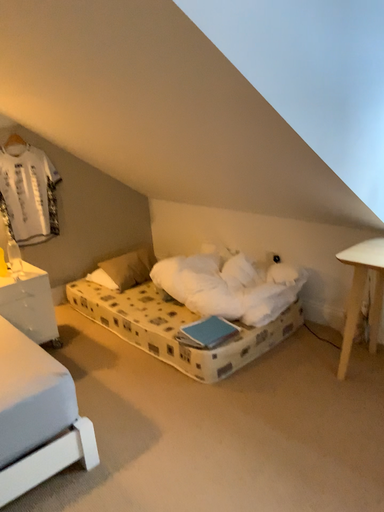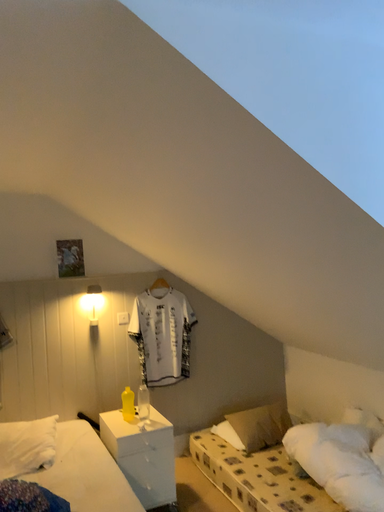
Question: Which way did the camera rotate in the video?

Choices:
 (A) rotated left
 (B) rotated right

Answer: (A)